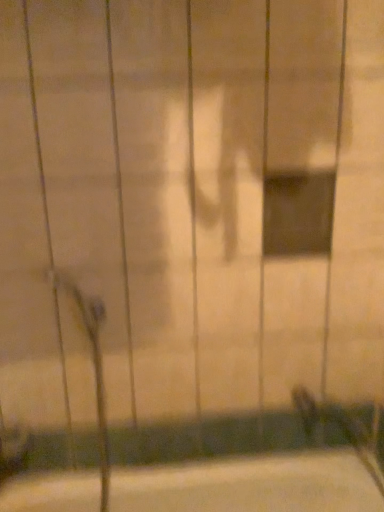
In order to face matte silver faucet at lower right, should I rotate leftwards or rightwards?

To align with it, rotate right about 21.035°.

What do you see at coordinates (337, 426) in the screenshot? I see `matte silver faucet at lower right` at bounding box center [337, 426].

Where is `matte silver faucet at lower right`? The image size is (384, 512). matte silver faucet at lower right is located at coordinates (337, 426).

Measure the distance between matte silver faucet at lower right and camera.

matte silver faucet at lower right is 4.44 feet from camera.

Locate an element on the screen. matte silver faucet at lower right is located at coordinates (337, 426).